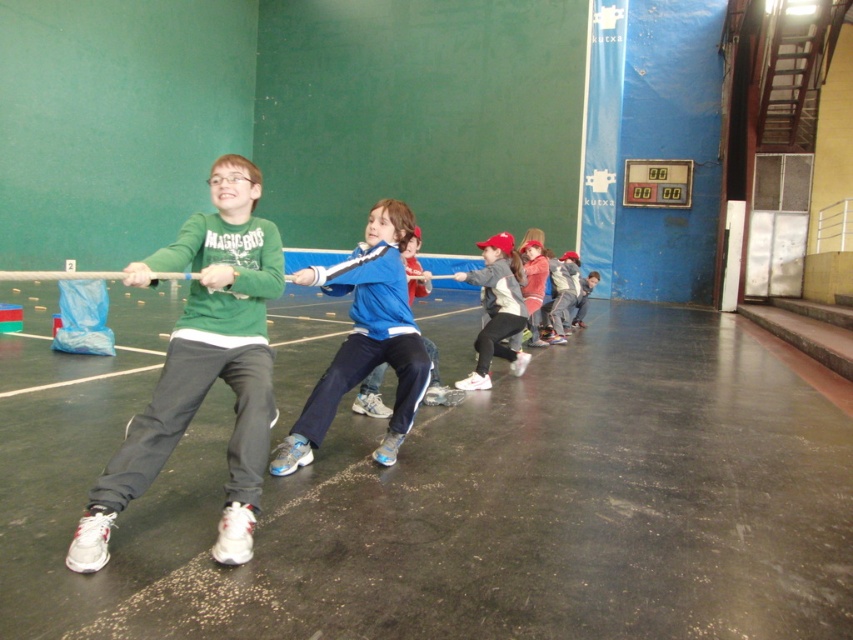
Question: Which point is farther to the camera?

Choices:
 (A) (508, 355)
 (B) (544, 284)

Answer: (B)

Question: Does blue matte jacket at center appear under blue fabric jacket at center?

Choices:
 (A) no
 (B) yes

Answer: (B)

Question: Considering the relative positions of green matte sweatshirt at left and white matte sneakers at center in the image provided, where is green matte sweatshirt at left located with respect to white matte sneakers at center?

Choices:
 (A) above
 (B) below

Answer: (B)

Question: Which of the following is the farthest from the observer?

Choices:
 (A) green matte sweatshirt at left
 (B) blue matte jacket at center
 (C) white matte sneakers at center

Answer: (C)

Question: Is green matte sweatshirt at left closer to camera compared to blue fabric pants at center?

Choices:
 (A) no
 (B) yes

Answer: (B)

Question: Which point is closer to the camera?

Choices:
 (A) blue fabric jacket at center
 (B) blue matte jacket at center
 (C) white matte sneakers at center
 (D) green matte sweatshirt at left

Answer: (D)